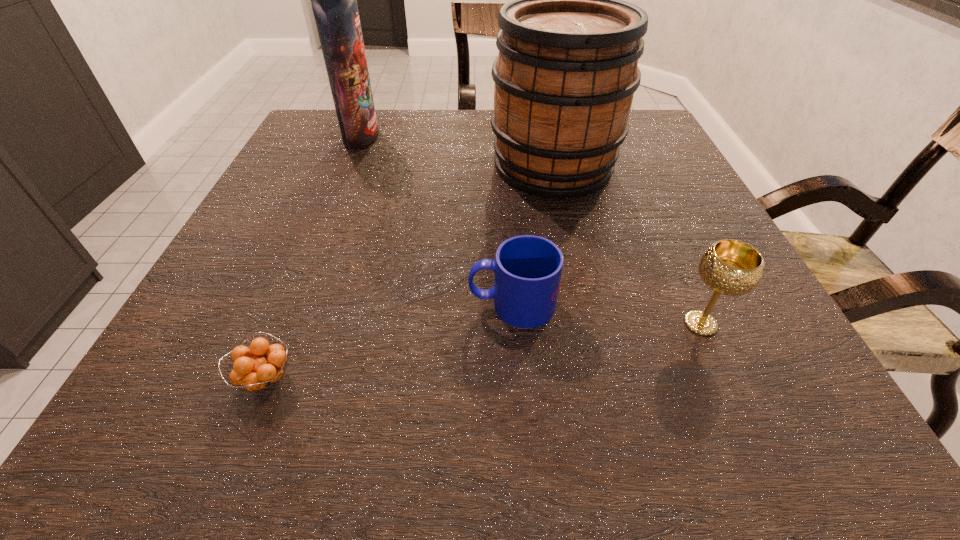
This screenshot has height=540, width=960. I want to click on object at the far left corner, so click(x=334, y=0).

Where is `object that is at the near left corner`? object that is at the near left corner is located at coordinates (258, 373).

At what (x,y) coordinates should I click in order to perform the action: click on object that is positioned at the far right corner. Please return your answer as a coordinate pair (x, y). The height and width of the screenshot is (540, 960). Looking at the image, I should click on pyautogui.click(x=567, y=69).

In the image, there is a desktop. Where is `vacant space at the far edge`? Image resolution: width=960 pixels, height=540 pixels. vacant space at the far edge is located at coordinates (417, 156).

Find the location of `free space at the near edge of the desktop`. free space at the near edge of the desktop is located at coordinates (382, 382).

Find the location of a particular element. The height and width of the screenshot is (540, 960). free space at the left edge is located at coordinates (278, 263).

Identify the location of free region at the right edge of the desktop. (645, 215).

Where is `free space at the far left corner of the desktop`? This screenshot has width=960, height=540. free space at the far left corner of the desktop is located at coordinates (318, 124).

At what (x,y) coordinates should I click in order to perform the action: click on blank region between the fourth tallest object and the chalice. Please return your answer as a coordinate pair (x, y). Looking at the image, I should click on (607, 314).

At what (x,y) coordinates should I click in order to perform the action: click on vacant area that lies between the fourth shortest object and the shortest object. Please return your answer as a coordinate pair (x, y). The image size is (960, 540). Looking at the image, I should click on (409, 272).